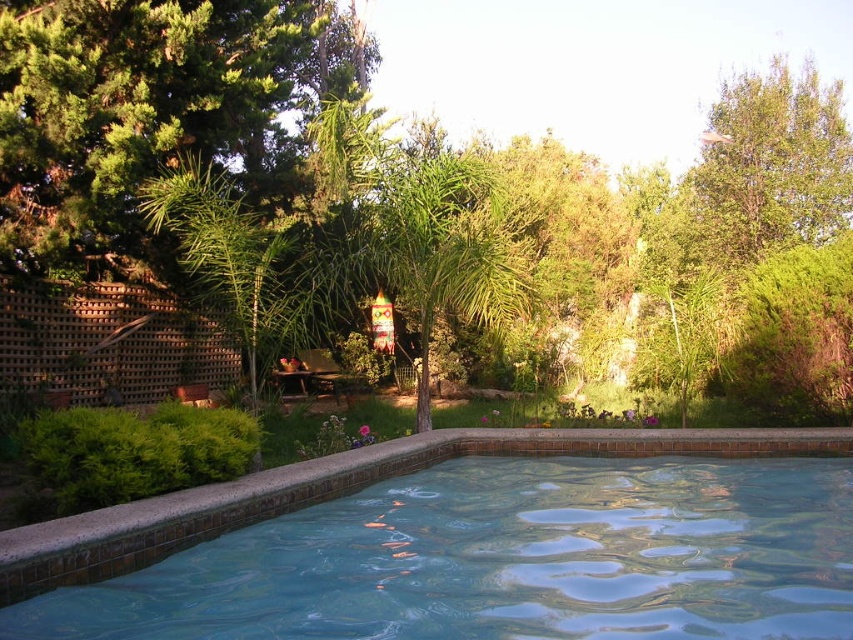
Does smooth concrete pool at center appear on the left side of green leafy palm tree at center?

In fact, smooth concrete pool at center is to the right of green leafy palm tree at center.

Does smooth concrete pool at center have a larger size compared to green leafy palm tree at center?

Actually, smooth concrete pool at center might be smaller than green leafy palm tree at center.

Who is more distant from viewer, (19,548) or (477,227)?

Positioned behind is point (477,227).

Locate an element on the screen. smooth concrete pool at center is located at coordinates (467, 545).

Can you confirm if smooth concrete pool at center is positioned to the right of green leafy tree at upper center?

In fact, smooth concrete pool at center is to the left of green leafy tree at upper center.

Does smooth concrete pool at center lie in front of green leafy tree at upper center?

That is True.

Who is more distant from viewer, [119,522] or [71,61]?

The point [71,61] is behind.

At what (x,y) coordinates should I click in order to perform the action: click on smooth concrete pool at center. Please return your answer as a coordinate pair (x, y). The height and width of the screenshot is (640, 853). Looking at the image, I should click on (467, 545).

Image resolution: width=853 pixels, height=640 pixels. I want to click on green leafy tree at upper center, so click(154, 113).

Is point (821, 136) closer to camera compared to point (402, 275)?

No, it is not.

I want to click on green leafy tree at upper center, so click(154, 113).